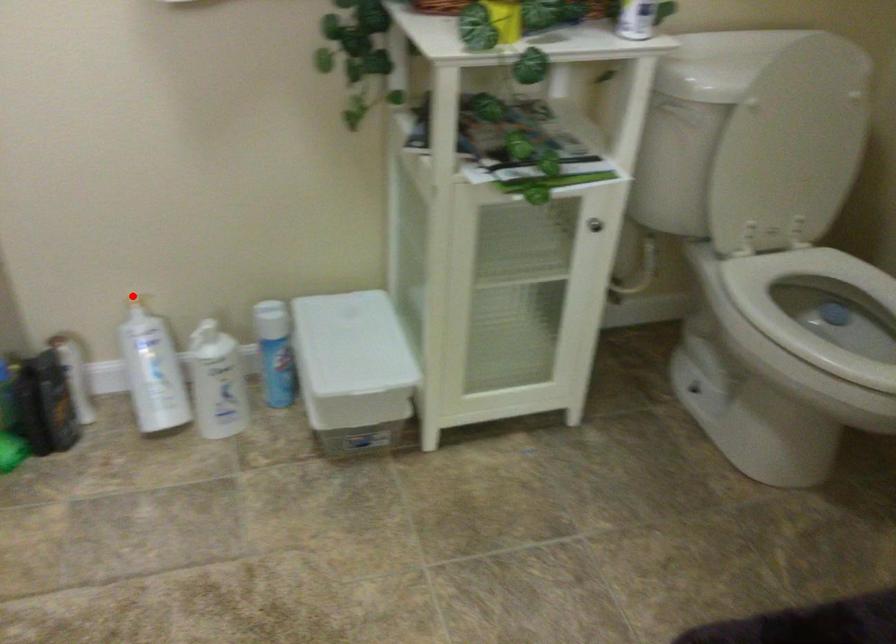
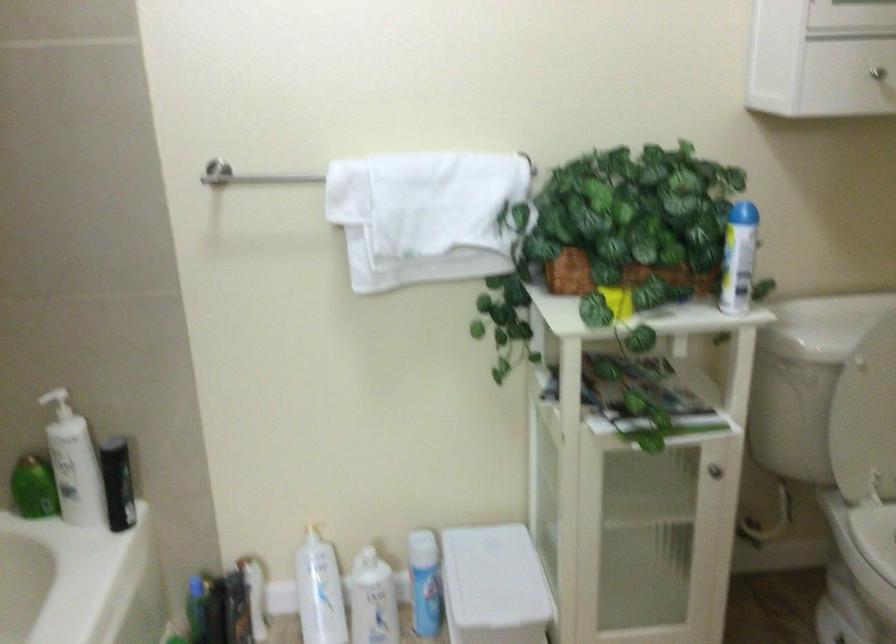
In the second image, find the point that corresponds to the highlighted location in the first image.

(306, 523)